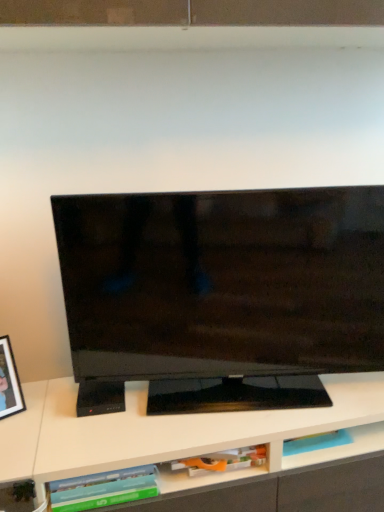
Question: Can you confirm if green matte book at lower center, positioned as the 1th book in left-to-right order, is thinner than matte orange book at lower center, which is the 1th book from right to left?

Choices:
 (A) no
 (B) yes

Answer: (A)

Question: From the image's perspective, is green matte book at lower center, positioned as the 1th book in left-to-right order, located above matte orange book at lower center, the 2th book from the left?

Choices:
 (A) yes
 (B) no

Answer: (B)

Question: Does green matte book at lower center, positioned as the 1th book in left-to-right order, have a greater width compared to matte orange book at lower center, which is the 1th book from right to left?

Choices:
 (A) yes
 (B) no

Answer: (A)

Question: From a real-world perspective, is green matte book at lower center, positioned as the 1th book in left-to-right order, on matte orange book at lower center, the 2th book from the left?

Choices:
 (A) no
 (B) yes

Answer: (B)

Question: Is green matte book at lower center, positioned as the 1th book in left-to-right order, further to camera compared to matte orange book at lower center, the 2th book from the left?

Choices:
 (A) no
 (B) yes

Answer: (A)

Question: Does green matte book at lower center, the second book positioned from the right, touch matte orange book at lower center, the 2th book from the left?

Choices:
 (A) yes
 (B) no

Answer: (B)

Question: Is matte orange book at lower center, the 2th book from the left, at the left side of green matte book at lower center, the second book positioned from the right?

Choices:
 (A) no
 (B) yes

Answer: (A)

Question: Is matte orange book at lower center, the 2th book from the left, to the right of green matte book at lower center, positioned as the 1th book in left-to-right order, from the viewer's perspective?

Choices:
 (A) yes
 (B) no

Answer: (A)

Question: Considering the relative sizes of matte orange book at lower center, the 2th book from the left, and green matte book at lower center, the second book positioned from the right, in the image provided, is matte orange book at lower center, the 2th book from the left, taller than green matte book at lower center, the second book positioned from the right,?

Choices:
 (A) no
 (B) yes

Answer: (A)

Question: Is matte orange book at lower center, which is the 1th book from right to left, behind green matte book at lower center, the second book positioned from the right?

Choices:
 (A) no
 (B) yes

Answer: (B)

Question: From a real-world perspective, does matte orange book at lower center, which is the 1th book from right to left, stand above green matte book at lower center, the second book positioned from the right?

Choices:
 (A) no
 (B) yes

Answer: (A)

Question: Does matte orange book at lower center, the 2th book from the left, come in front of green matte book at lower center, the second book positioned from the right?

Choices:
 (A) yes
 (B) no

Answer: (B)

Question: Can you confirm if green matte book at lower center, positioned as the 1th book in left-to-right order, is positioned to the left of black glossy tv at center?

Choices:
 (A) no
 (B) yes

Answer: (B)